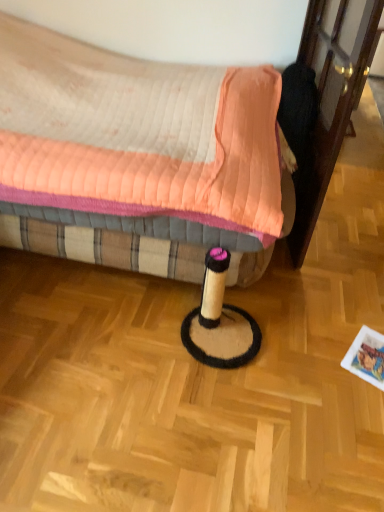
Question: Is quilted fabric bed at center at the back of transparent glass screen door at right?

Choices:
 (A) yes
 (B) no

Answer: (A)

Question: Does transparent glass screen door at right come in front of quilted fabric bed at center?

Choices:
 (A) no
 (B) yes

Answer: (A)

Question: Is transparent glass screen door at right at the right side of quilted fabric bed at center?

Choices:
 (A) yes
 (B) no

Answer: (A)

Question: Does transparent glass screen door at right have a lesser width compared to quilted fabric bed at center?

Choices:
 (A) yes
 (B) no

Answer: (A)

Question: From a real-world perspective, is transparent glass screen door at right positioned over quilted fabric bed at center based on gravity?

Choices:
 (A) yes
 (B) no

Answer: (A)

Question: Considering the relative sizes of transparent glass screen door at right and quilted fabric bed at center in the image provided, is transparent glass screen door at right taller than quilted fabric bed at center?

Choices:
 (A) yes
 (B) no

Answer: (A)

Question: Is quilted fabric bed at center oriented away from transparent glass screen door at right?

Choices:
 (A) yes
 (B) no

Answer: (B)

Question: Can you see quilted fabric bed at center touching transparent glass screen door at right?

Choices:
 (A) no
 (B) yes

Answer: (A)

Question: Considering the relative sizes of quilted fabric bed at center and transparent glass screen door at right in the image provided, is quilted fabric bed at center thinner than transparent glass screen door at right?

Choices:
 (A) yes
 (B) no

Answer: (B)

Question: Does quilted fabric bed at center have a lesser height compared to transparent glass screen door at right?

Choices:
 (A) yes
 (B) no

Answer: (A)

Question: Does quilted fabric bed at center appear on the left side of transparent glass screen door at right?

Choices:
 (A) no
 (B) yes

Answer: (B)

Question: From a real-world perspective, is quilted fabric bed at center located higher than transparent glass screen door at right?

Choices:
 (A) yes
 (B) no

Answer: (B)

Question: Visually, is quilted fabric bed at center positioned to the left or to the right of transparent glass screen door at right?

Choices:
 (A) left
 (B) right

Answer: (A)